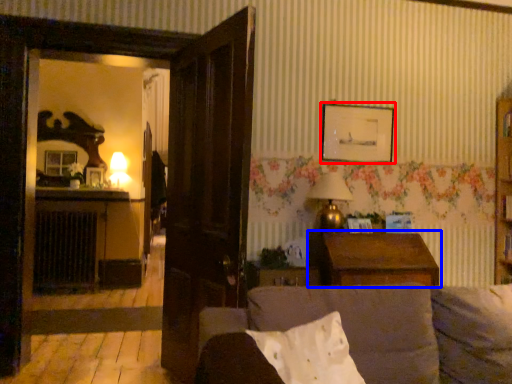
Question: Which object appears farthest to the camera in this image, picture frame (highlighted by a red box) or table (highlighted by a blue box)?

Choices:
 (A) picture frame
 (B) table

Answer: (A)